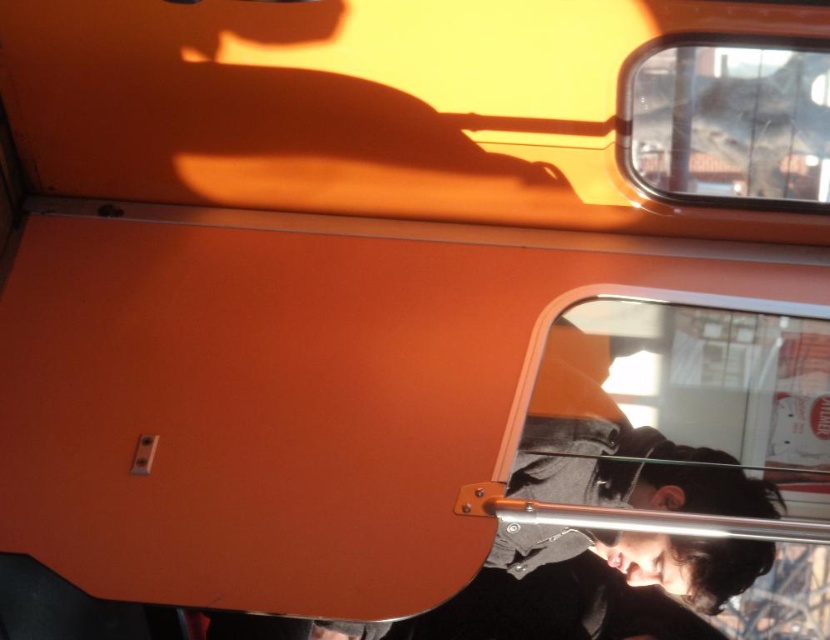
Question: Which of the following is the farthest from the observer?

Choices:
 (A) (747, 173)
 (B) (676, 538)

Answer: (A)

Question: Can you confirm if transparent glass window at lower right is positioned above transparent glass train window at upper right?

Choices:
 (A) no
 (B) yes

Answer: (A)

Question: Is transparent glass window at lower right to the right of transparent glass train window at upper right from the viewer's perspective?

Choices:
 (A) no
 (B) yes

Answer: (A)

Question: Is transparent glass window at lower right thinner than transparent glass train window at upper right?

Choices:
 (A) no
 (B) yes

Answer: (A)

Question: Which of the following is the farthest from the observer?

Choices:
 (A) transparent glass train window at upper right
 (B) transparent glass window at lower right

Answer: (A)